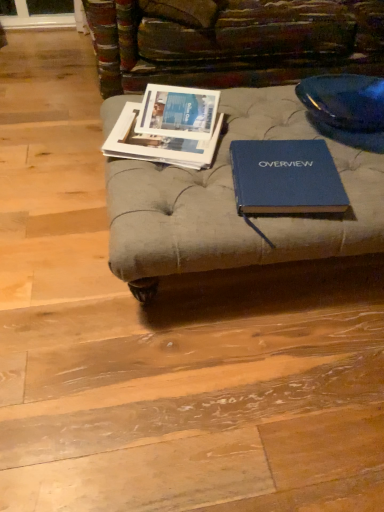
Locate an element on the screen. This screenshot has width=384, height=512. vacant area situated below matte paper magazine at center (from a real-world perspective) is located at coordinates [x=183, y=118].